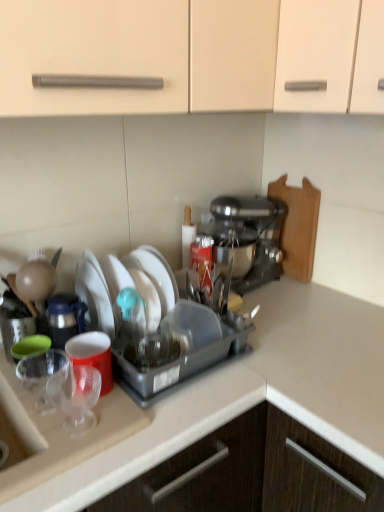
Find the location of a particular element. free space to the left of matte plastic cup at left is located at coordinates (41, 399).